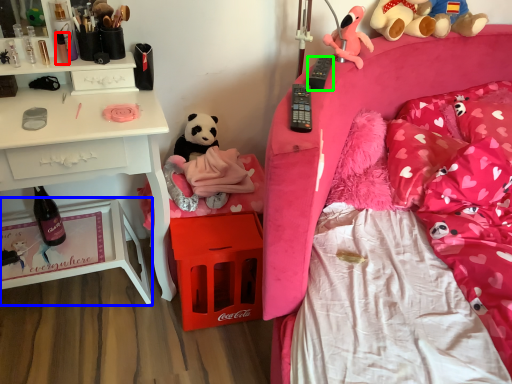
Question: Based on their relative distances, which object is nearer to toiletry (highlighted by a red box)? Choose from nightstand (highlighted by a blue box) and remote control (highlighted by a green box).

Choices:
 (A) nightstand
 (B) remote control

Answer: (A)